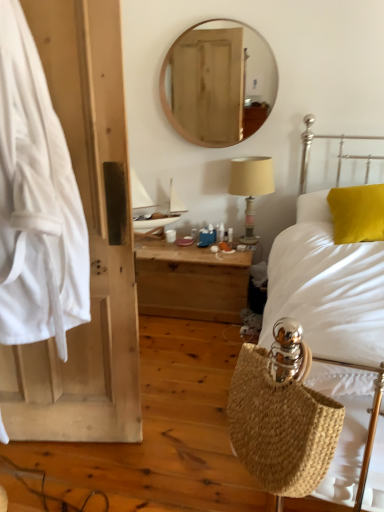
Question: Is wooden round mirror at upper center situated inside beige fabric lampshade at upper right or outside?

Choices:
 (A) inside
 (B) outside

Answer: (B)

Question: From a real-world perspective, is wooden round mirror at upper center above or below beige fabric lampshade at upper right?

Choices:
 (A) below
 (B) above

Answer: (B)

Question: Which of these objects is positioned farthest from the beige fabric lampshade at upper right?

Choices:
 (A) wooden nightstand at center
 (B) yellow fabric pillow at right
 (C) natural woven basket at lower right
 (D) white fabric at left
 (E) wooden round mirror at upper center

Answer: (C)

Question: Estimate the real-world distances between objects in this image. Which object is farther from the yellow fabric pillow at right?

Choices:
 (A) white fabric at left
 (B) white woven bag at right
 (C) wooden round mirror at upper center
 (D) wooden nightstand at center
 (E) beige fabric lampshade at upper right

Answer: (C)